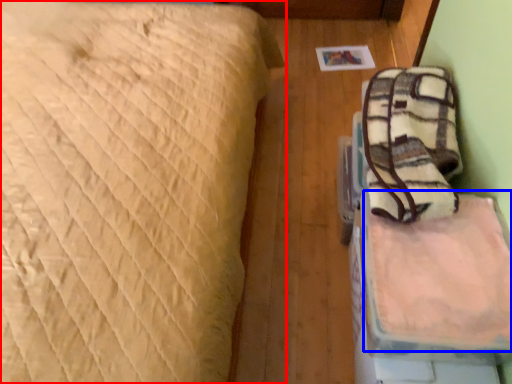
Question: Among these objects, which one is farthest to the camera, bed (highlighted by a red box) or sheet (highlighted by a blue box)?

Choices:
 (A) bed
 (B) sheet

Answer: (B)